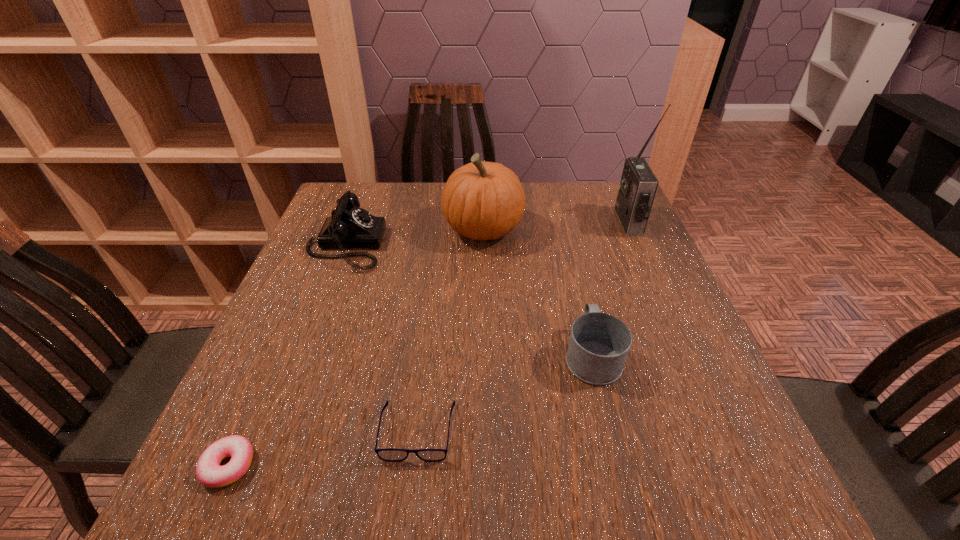
Find the location of `vacant space located on the display of the tallest object`. vacant space located on the display of the tallest object is located at coordinates (493, 222).

Where is `vacant space located on the stem of the pumpkin`? This screenshot has width=960, height=540. vacant space located on the stem of the pumpkin is located at coordinates pos(336,230).

Identify the location of free point located on the stem of the pumpkin. (380, 230).

This screenshot has height=540, width=960. I want to click on vacant space situated on the stem of the pumpkin, so [410, 230].

You are a GUI agent. You are given a task and a screenshot of the screen. Output one action in this format:
    pyautogui.click(x=<x>, y=<y>)
    Task: Click on the vacant space located on the dial of the telephone
    
    Given the screenshot: What is the action you would take?
    pyautogui.click(x=452, y=245)

Where is `vacant space located 0.090m on the side of the third shortest object with the handle`? vacant space located 0.090m on the side of the third shortest object with the handle is located at coordinates (578, 298).

You are a GUI agent. You are given a task and a screenshot of the screen. Output one action in this format:
    pyautogui.click(x=<x>, y=<y>)
    Task: Click on the vacant space positioned on the side of the third shortest object with the handle
    
    Given the screenshot: What is the action you would take?
    pyautogui.click(x=581, y=307)

The width and height of the screenshot is (960, 540). Find the location of `free space located 0.140m on the side of the third shortest object with the handle`. free space located 0.140m on the side of the third shortest object with the handle is located at coordinates [575, 284].

I want to click on vacant space located on the front-facing side of the spectacles, so click(411, 495).

Find the location of `blank space located on the right of the doughnut`. blank space located on the right of the doughnut is located at coordinates (447, 465).